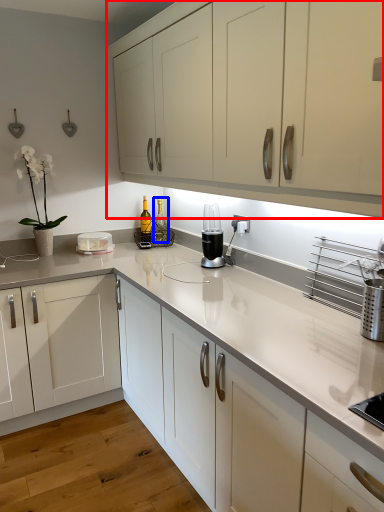
Question: Which object appears farthest to the camera in this image, cabinetry (highlighted by a red box) or bottle (highlighted by a blue box)?

Choices:
 (A) cabinetry
 (B) bottle

Answer: (B)